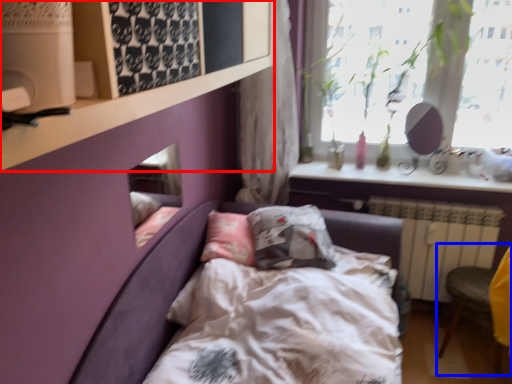
Question: Which object appears farthest to the camera in this image, shelf (highlighted by a red box) or armchair (highlighted by a blue box)?

Choices:
 (A) shelf
 (B) armchair

Answer: (B)